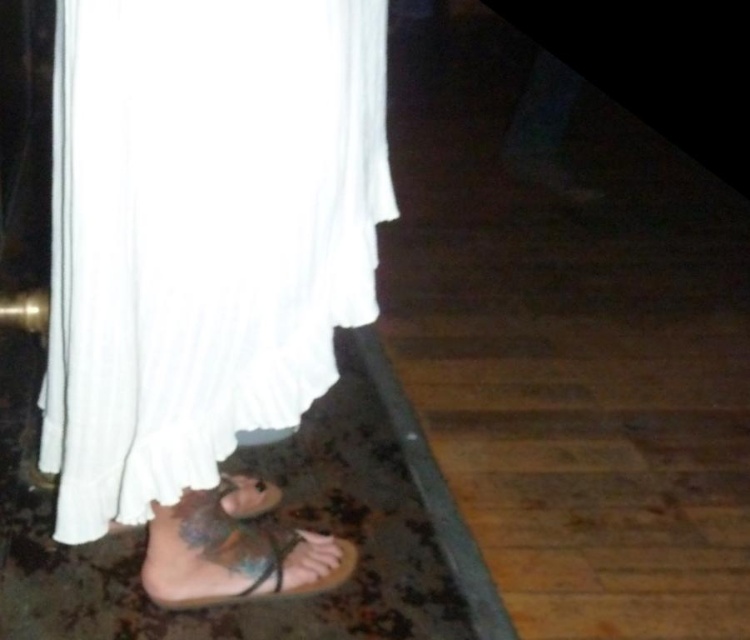
You are standing in a room with wooden flooring and see the white cotton dress at lower left and the leather sandal at lower center. Which object is nearer to you?

The white cotton dress at lower left is closer to the viewer than the leather sandal at lower center.

You are standing in a room with wooden flooring and want to step onto the dark carpet behind the white cotton dress at lower left. The dress is 30.07 inches away from you. If your stride length is 28 inches, will you need to take a second step to reach the carpet after stepping over the dress?

The white cotton dress at lower left is 30.07 inches away. Since your stride length is 28 inches, you will need to take a second step to reach the dark carpet behind the dress because the first step only covers 28 inches, leaving a remaining distance of approximately 2.07 inches.

From the picture: You are a photographer setting up a shoot in the described scene. You need to position a small prop between the white cotton dress at lower left and the leather sandal at lower center. Based on their positions, where should you place the prop so it is equidistant from both objects?

The prop should be placed exactly halfway between the white cotton dress at lower left and the leather sandal at lower center since the white cotton dress at lower left is to the left of leather sandal at lower center.